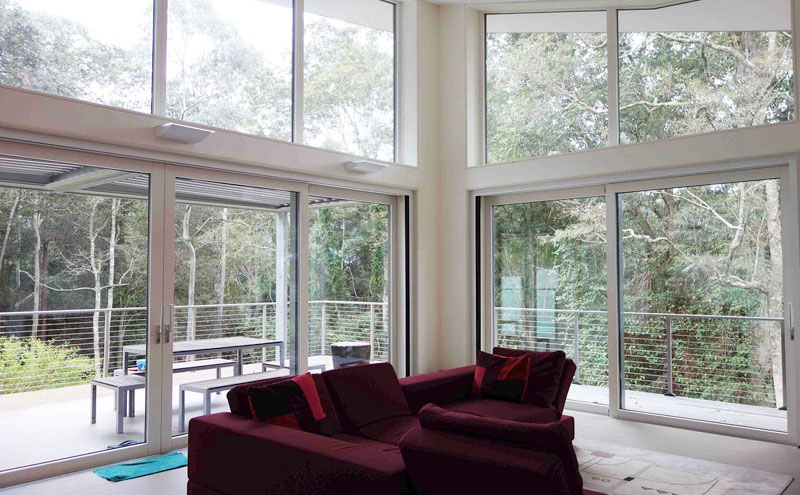
At what (x,y) coordinates should I click in order to perform the action: click on window. Please return your answer as a coordinate pair (x, y). The height and width of the screenshot is (495, 800). Looking at the image, I should click on (108, 26), (346, 45), (726, 69).